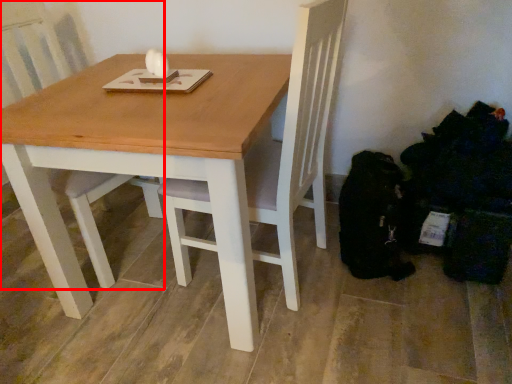
Question: From the image, what is the correct spatial relationship of chair (annotated by the red box) in relation to table?

Choices:
 (A) right
 (B) left

Answer: (B)